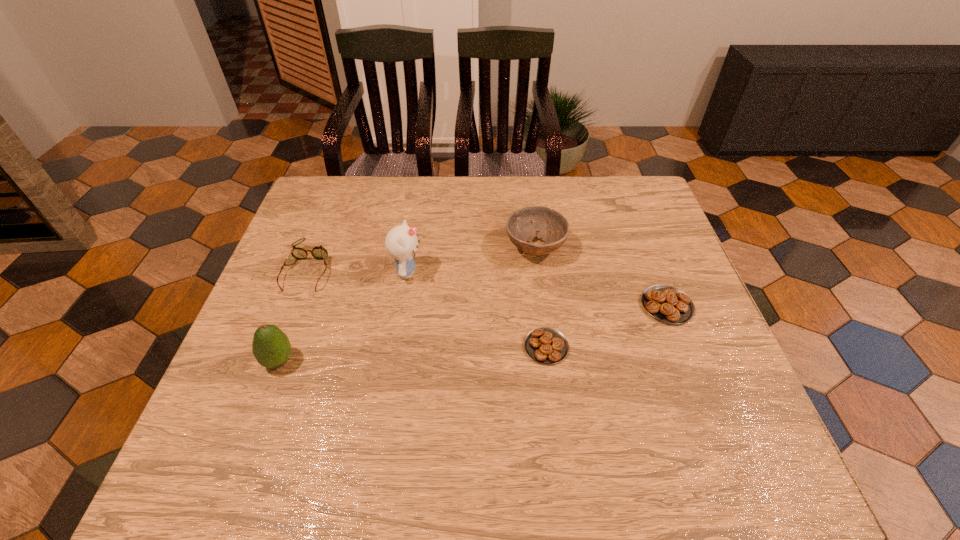
You are a GUI agent. You are given a task and a screenshot of the screen. Output one action in this format:
    pyautogui.click(x=<x>, y=<y>)
    Task: Click on the nearer pastry
    The width and height of the screenshot is (960, 540).
    Given the screenshot: What is the action you would take?
    pyautogui.click(x=545, y=345)

What are the coordinates of `the left pastry` in the screenshot? It's located at (545, 345).

The width and height of the screenshot is (960, 540). Find the location of `the second shortest object`. the second shortest object is located at coordinates (668, 304).

The height and width of the screenshot is (540, 960). Identify the location of the farther pastry. [668, 304].

You are a GUI agent. You are given a task and a screenshot of the screen. Output one action in this format:
    pyautogui.click(x=<x>, y=<y>)
    Task: Click on the kitten
    The height and width of the screenshot is (540, 960).
    Given the screenshot: What is the action you would take?
    pyautogui.click(x=401, y=242)

Locate an element on the screen. This screenshot has width=960, height=540. the tallest object is located at coordinates (401, 242).

The image size is (960, 540). In order to click on bowl in this screenshot , I will do [521, 227].

I want to click on avocado, so [x=271, y=347].

Image resolution: width=960 pixels, height=540 pixels. Identify the location of spectacles. (318, 252).

The height and width of the screenshot is (540, 960). In order to click on blank space located on the front of the nearer pastry in this screenshot , I will do `click(552, 395)`.